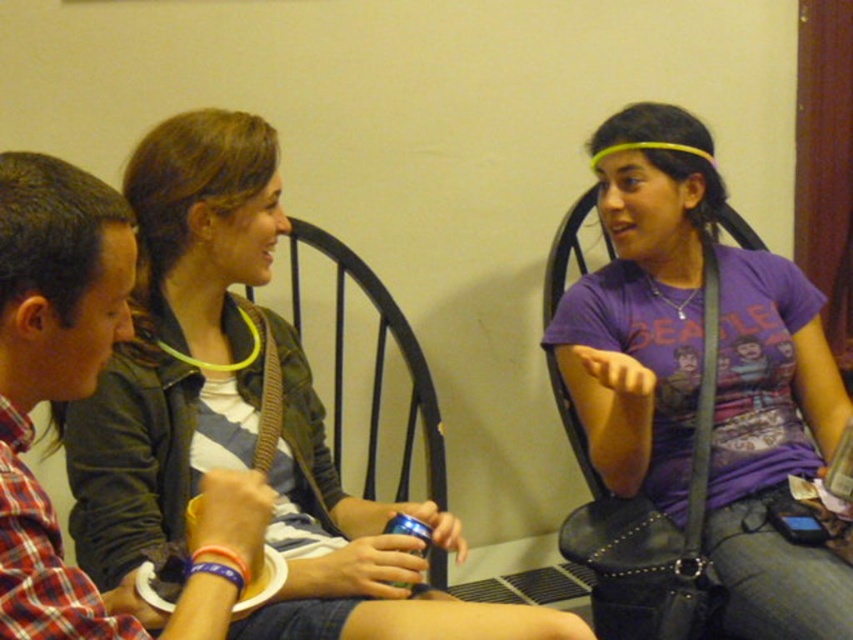
Question: Which of the following is the farthest from the observer?

Choices:
 (A) purple matte shirt at center
 (B) black metal chair at center

Answer: (B)

Question: In this image, where is purple matte shirt at center located relative to black metal chair at center?

Choices:
 (A) right
 (B) left

Answer: (A)

Question: Which point is farther to the camera?

Choices:
 (A) purple matte shirt at center
 (B) black metal chair at center

Answer: (B)

Question: Among these points, which one is nearest to the camera?

Choices:
 (A) (825, 429)
 (B) (402, 326)

Answer: (A)

Question: Does purple matte shirt at center have a smaller size compared to black metal chair at center?

Choices:
 (A) no
 (B) yes

Answer: (A)

Question: Where is purple matte shirt at center located in relation to black metal chair at center in the image?

Choices:
 (A) above
 (B) below

Answer: (A)